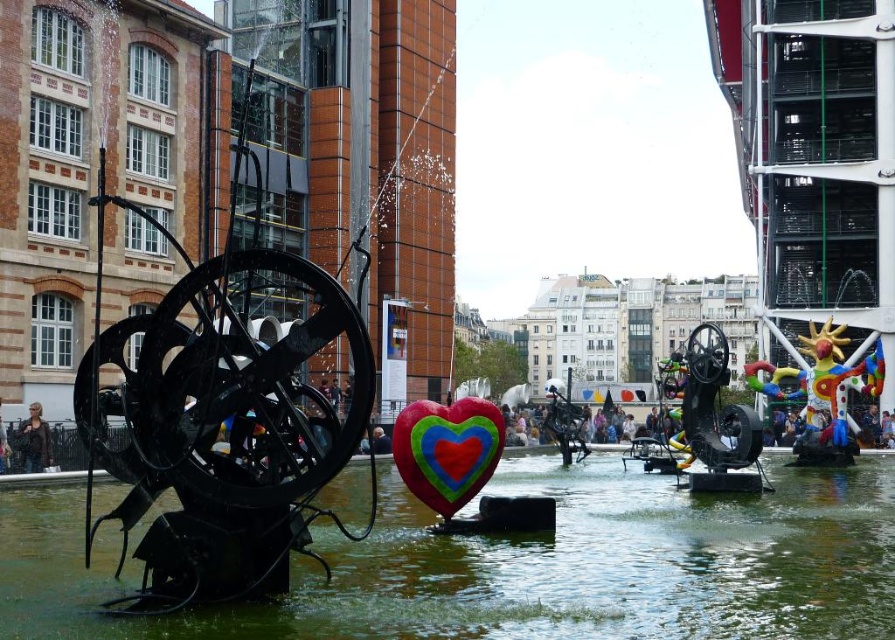
Can you confirm if green metallic water at center is bigger than multicolored fabric heart at center?

Indeed, green metallic water at center has a larger size compared to multicolored fabric heart at center.

Is the position of green metallic water at center less distant than that of multicolored fabric heart at center?

Yes.

Locate an element on the screen. The height and width of the screenshot is (640, 895). green metallic water at center is located at coordinates (521, 564).

Can you confirm if matte black jacket at left is taller than smooth skin person at center?

In fact, matte black jacket at left may be shorter than smooth skin person at center.

Can you confirm if matte black jacket at left is positioned to the right of smooth skin person at center?

No, matte black jacket at left is not to the right of smooth skin person at center.

The image size is (895, 640). What do you see at coordinates (33, 440) in the screenshot? I see `matte black jacket at left` at bounding box center [33, 440].

I want to click on matte black jacket at left, so tap(33, 440).

Does multicolored fabric heart at center appear on the right side of matte black jacket at left?

Yes, multicolored fabric heart at center is to the right of matte black jacket at left.

Between point (489, 429) and point (18, 436), which one is positioned in front?

Point (489, 429) is in front.

Which is in front, point (398, 465) or point (24, 420)?

Point (398, 465) is in front.

The height and width of the screenshot is (640, 895). I want to click on multicolored fabric heart at center, so click(x=448, y=449).